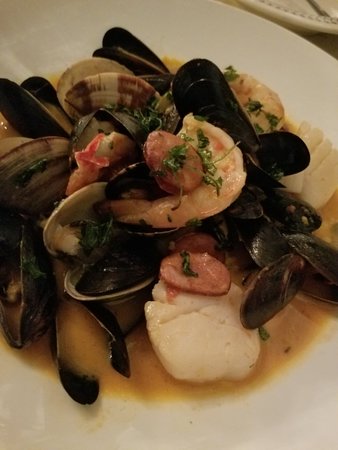
Locate an element on the screen. dipping sauce in small bowl is located at coordinates (113, 278).